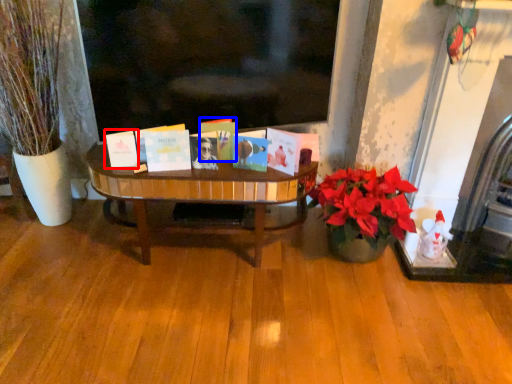
Question: Which object is closer to the camera taking this photo, book (highlighted by a red box) or book (highlighted by a blue box)?

Choices:
 (A) book
 (B) book

Answer: (A)